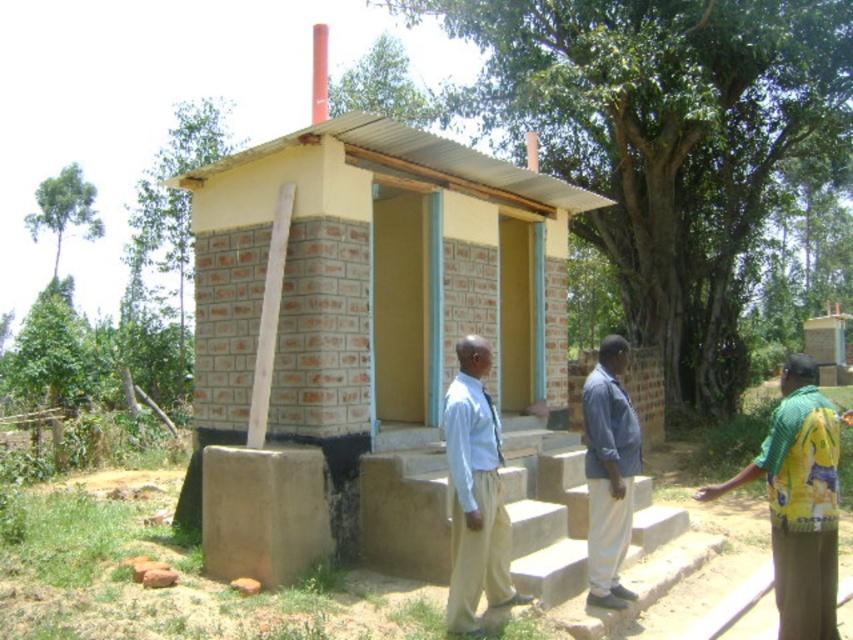
Who is positioned more to the left, brown concrete stairs at center or light blue shirt at center?

From the viewer's perspective, light blue shirt at center appears more on the left side.

Can you confirm if brown concrete stairs at center is taller than light blue shirt at center?

No, brown concrete stairs at center is not taller than light blue shirt at center.

Where is `brown concrete stairs at center`? The image size is (853, 640). brown concrete stairs at center is located at coordinates (584, 531).

Between light blue shirt at center and blue fabric shirt at center, which one is positioned lower?

blue fabric shirt at center is lower down.

Can you confirm if light blue shirt at center is smaller than blue fabric shirt at center?

Actually, light blue shirt at center might be larger than blue fabric shirt at center.

Who is more forward, (454, 621) or (628, 486)?

Point (454, 621)

Image resolution: width=853 pixels, height=640 pixels. I want to click on light blue shirt at center, so click(x=474, y=492).

Based on the photo, can you confirm if green printed shirt at right is wider than blue fabric shirt at center?

Yes.

Is point (804, 512) positioned behind point (625, 490)?

No, it is not.

Where is `green printed shirt at right`? Image resolution: width=853 pixels, height=640 pixels. green printed shirt at right is located at coordinates (799, 500).